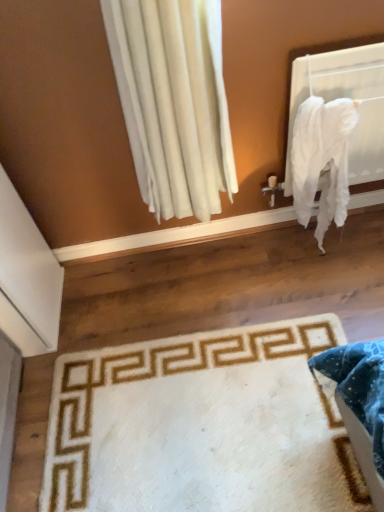
The width and height of the screenshot is (384, 512). In order to click on blank space situated above white plush rug at lower center (from a real-world perspective) in this screenshot , I will do point(206,418).